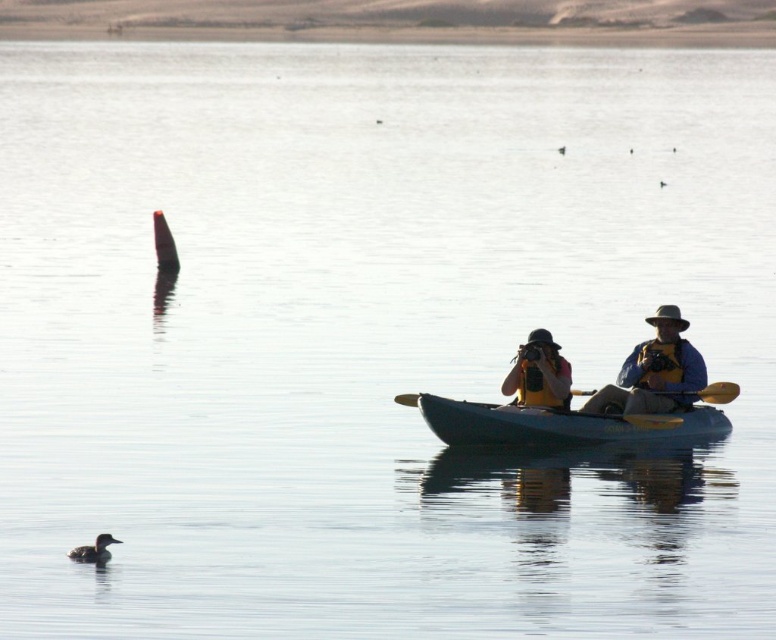
You are planning to take a photo of the brown fuzzy duck at lower left from the matte yellow kayak at center. Considering the kayak and duck sizes, will the kayak block the view of the duck when you aim the camera directly at it?

The matte yellow kayak at center is wider than the brown fuzzy duck at lower left. Since the kayak is larger in width, it might block the view of the duck if positioned directly between the camera and the duck. Adjust your angle or position to ensure the duck remains visible.

You are planning to take a photo of the brown fuzzy duck at lower left while in the matte yellow kayak at center. Is the kayak blocking your view of the duck?

The matte yellow kayak at center is positioned over brown fuzzy duck at lower left, so yes, the kayak is blocking the view of the duck.